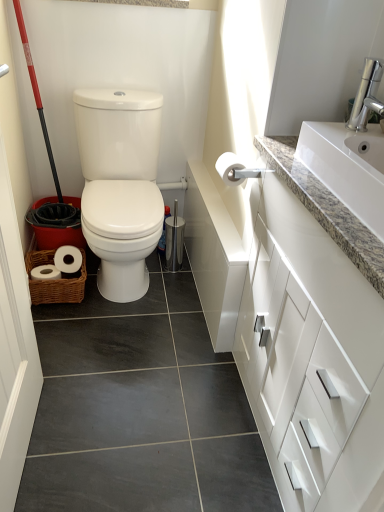
Question: From a real-world perspective, is silver metallic faucet at upper right physically located above or below white matte toilet paper at upper right?

Choices:
 (A) above
 (B) below

Answer: (A)

Question: From the image's perspective, relative to white matte toilet paper at upper right, is silver metallic faucet at upper right above or below?

Choices:
 (A) below
 (B) above

Answer: (B)

Question: Estimate the real-world distances between objects in this image. Which object is closer to the silver metallic faucet at upper right?

Choices:
 (A) white matte toilet paper at upper right
 (B) white granite sink at upper right
 (C) white glossy cabinet at upper right

Answer: (B)

Question: Which object is the farthest from the silver metallic faucet at upper right?

Choices:
 (A) white matte toilet paper at upper right
 (B) white glossy cabinet at upper right
 (C) white granite sink at upper right

Answer: (B)